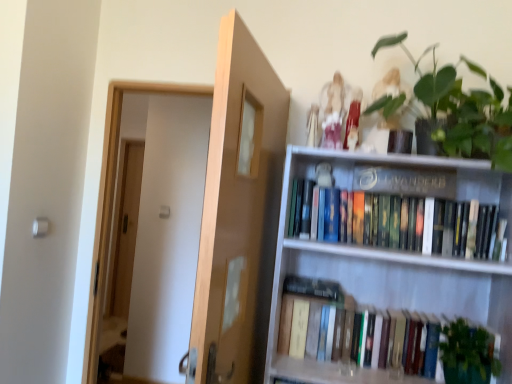
Question: From their relative heights in the image, would you say matte black bookshelf at upper center is taller or shorter than green leafy plant at lower right?

Choices:
 (A) tall
 (B) short

Answer: (B)

Question: Do you think matte black bookshelf at upper center is within green leafy plant at lower right, or outside of it?

Choices:
 (A) inside
 (B) outside

Answer: (B)

Question: Which object is positioned farthest from the white wooden bookshelf at upper right?

Choices:
 (A) hardcover books at lower right, which is the second book from top to bottom
 (B) hardcover books at upper right, which appears as the 1th book when viewed from the top
 (C) green matte plant at upper right
 (D) matte white statue at upper center
 (E) green leafy plant at lower right

Answer: (D)

Question: Which of these objects is positioned farthest from the matte black bookshelf at upper center?

Choices:
 (A) light brown wood door at center
 (B) green matte plant at upper right
 (C) hardcover books at lower right, which is the 1th book in bottom-to-top order
 (D) matte white statue at upper center
 (E) hardcover books at upper right, which appears as the 1th book when viewed from the top

Answer: (A)